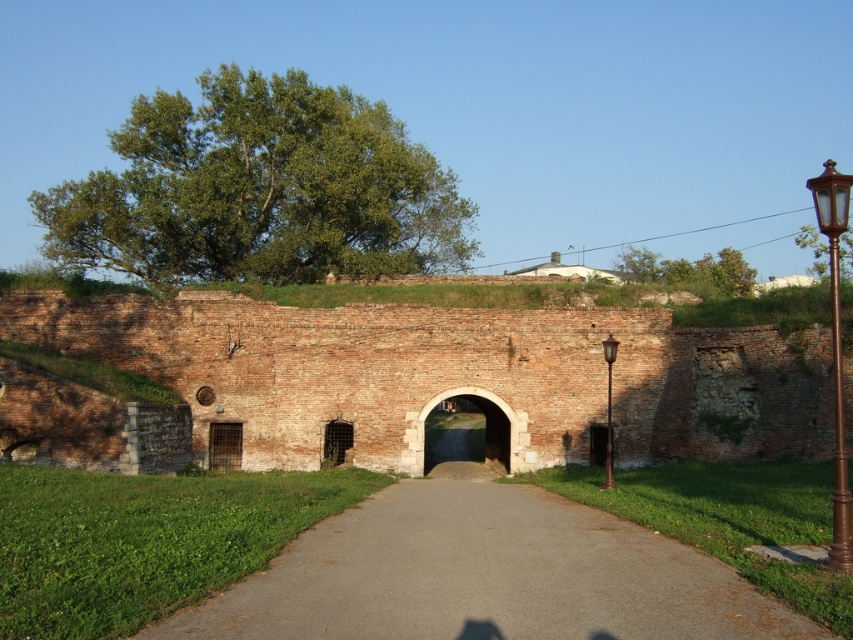
Looking at this image, you are standing in front of the historic brick wall and want to walk towards the smooth stone archway at center. Which direction should you move relative to the gray asphalt path at center?

Since the gray asphalt path at center is closer to the viewer than the smooth stone archway at center, you should move forward away from the gray asphalt path at center towards the smooth stone archway at center.

You are standing on the gray asphalt path at center and want to walk through the smooth stone archway at center. Which direction should you move to reach the archway?

Since the gray asphalt path at center is to the left of the smooth stone archway at center, you should move to your right to reach the archway.

You are a tourist walking towards the historic brick wall with the arched gateway. You see the gray asphalt path at center and the brown polished metal lamp post at right. Which object is closer to you as you approach the wall?

The gray asphalt path at center is positioned under the brown polished metal lamp post at right, meaning the lamp post is closer to you since it is above the path.